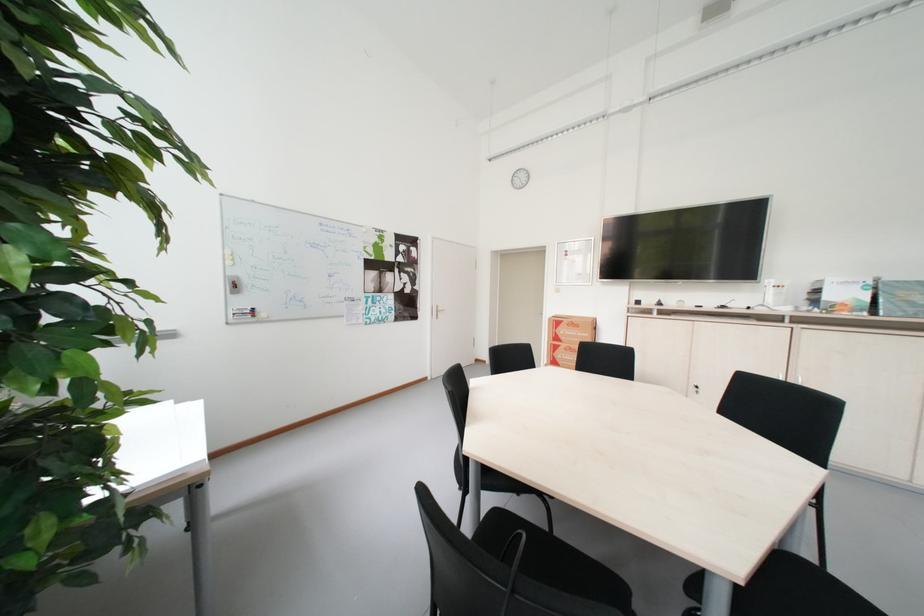
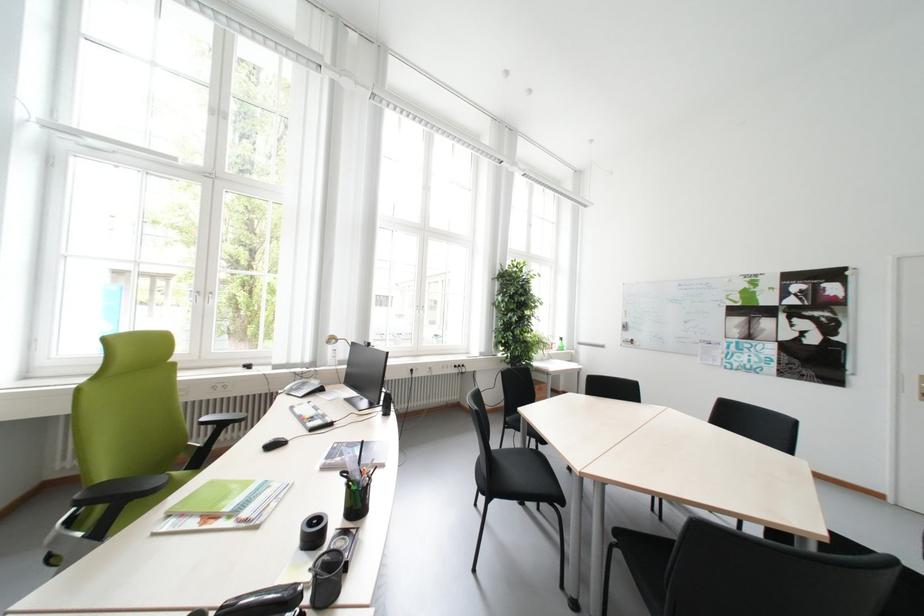
Question: I am providing you with two images of the same scene from different viewpoints. Please identify which objects are invisible in image2.

Choices:
 (A) blue and white cube
 (B) red whiteboard marker
 (C) black chair sitting surface
 (D) green chair sitting surface

Answer: (C)